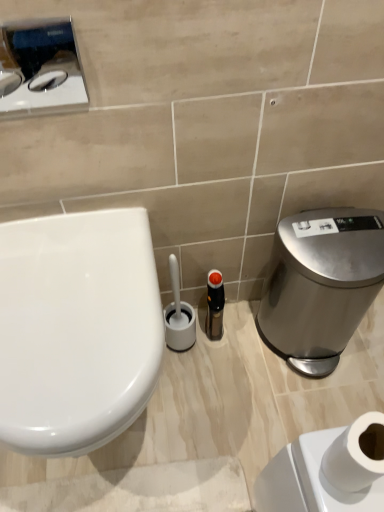
You are a GUI agent. You are given a task and a screenshot of the screen. Output one action in this format:
    pyautogui.click(x=<x>, y=<y>)
    Task: Click on the free space in front of black plastic bottle at center
    Image resolution: width=384 pixels, height=512 pixels.
    Given the screenshot: What is the action you would take?
    pyautogui.click(x=216, y=381)